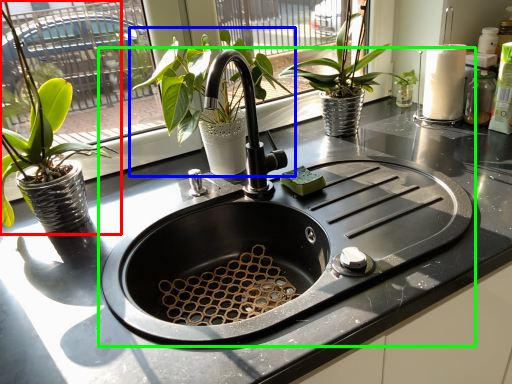
Question: Which object is positioned farthest from houseplant (highlighted by a red box)? Select from houseplant (highlighted by a blue box) and sink (highlighted by a green box).

Choices:
 (A) houseplant
 (B) sink

Answer: (B)